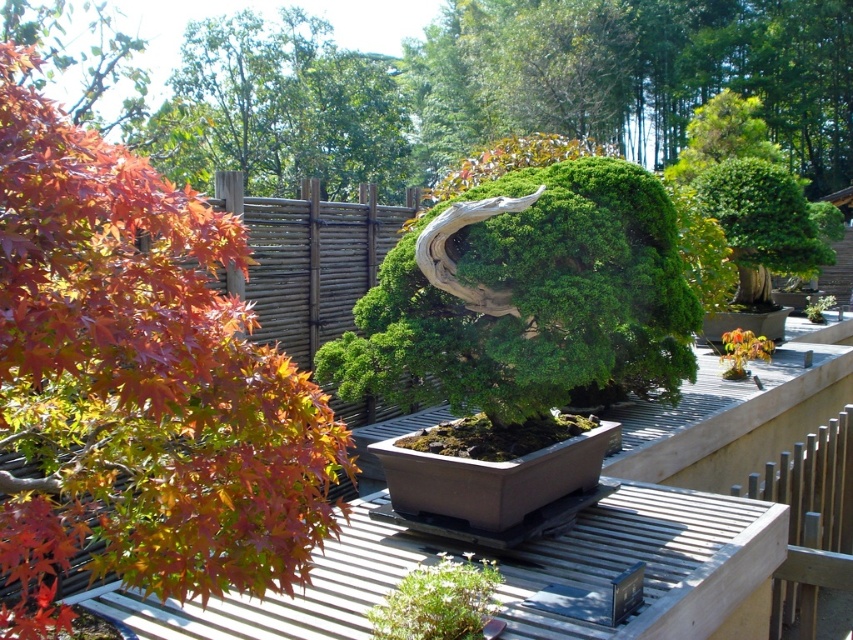
You are standing in the garden and want to locate the green textured bonsai tree at center. According to the coordinate system where the bottom left corner is the origin, what are its coordinates?

The green textured bonsai tree at center is located at coordinates approximately 0.466 on the x axis and 0.618 on the y axis.

You are a gardener planning to water the green matte bonsai tree at center and the green textured bonsai tree at center. Since both are at the center, how can you distinguish which one is lower in position?

The green matte bonsai tree at center is positioned below the green textured bonsai tree at center, so you can tell the lower one is the matte one.